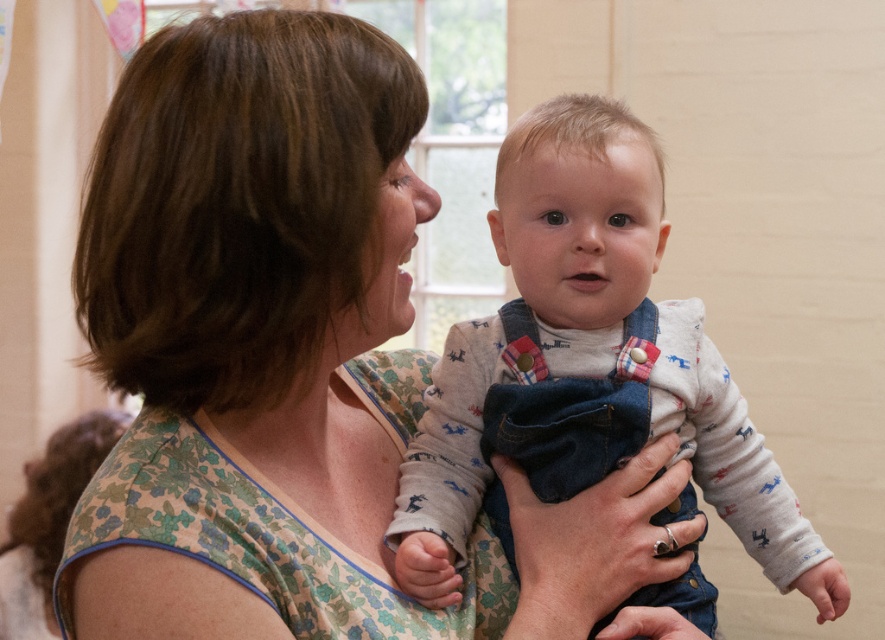
Question: Which of the following is the farthest from the observer?

Choices:
 (A) (720, 492)
 (B) (312, 320)

Answer: (A)

Question: Considering the relative positions of floral fabric dress at center and denim overalls at center in the image provided, where is floral fabric dress at center located with respect to denim overalls at center?

Choices:
 (A) above
 (B) below

Answer: (A)

Question: Is floral fabric dress at center below denim overalls at center?

Choices:
 (A) yes
 (B) no

Answer: (B)

Question: Can you confirm if floral fabric dress at center is positioned below denim overalls at center?

Choices:
 (A) no
 (B) yes

Answer: (A)